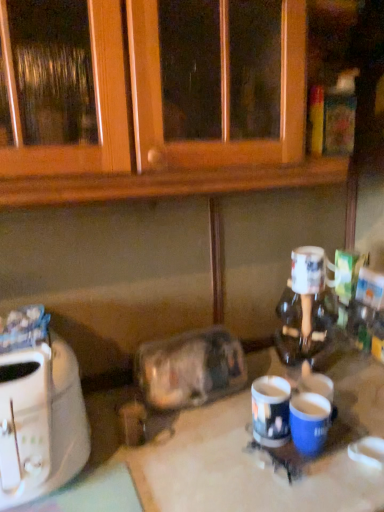
Find the location of `vacant region in front of blue glossy mug at center, positioned as the second coffee cup in bottom-to-top order`. vacant region in front of blue glossy mug at center, positioned as the second coffee cup in bottom-to-top order is located at coordinates (280, 485).